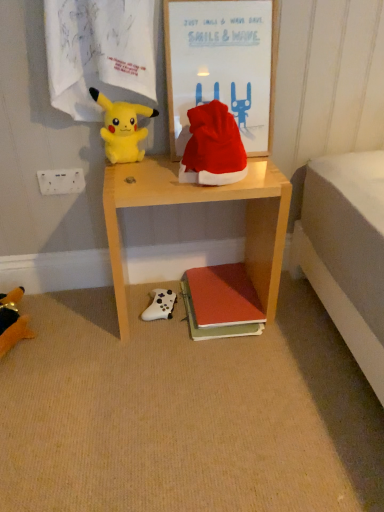
Image resolution: width=384 pixels, height=512 pixels. Identify the location of free spot to the right of matte orange book at lower center. (302, 318).